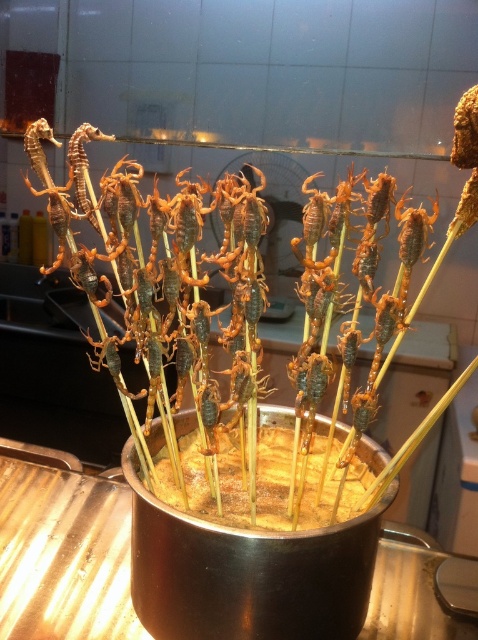
In the scene shown: Can you confirm if brown crunchy scorpion at center is positioned below brown crispy scorpions at center?

No, brown crunchy scorpion at center is not below brown crispy scorpions at center.

Does brown crunchy scorpion at center have a greater width compared to brown crispy scorpions at center?

Indeed, brown crunchy scorpion at center has a greater width compared to brown crispy scorpions at center.

What do you see at coordinates (253, 328) in the screenshot?
I see `brown crunchy scorpion at center` at bounding box center [253, 328].

Where is `brown crunchy scorpion at center`? The image size is (478, 640). brown crunchy scorpion at center is located at coordinates (253, 328).